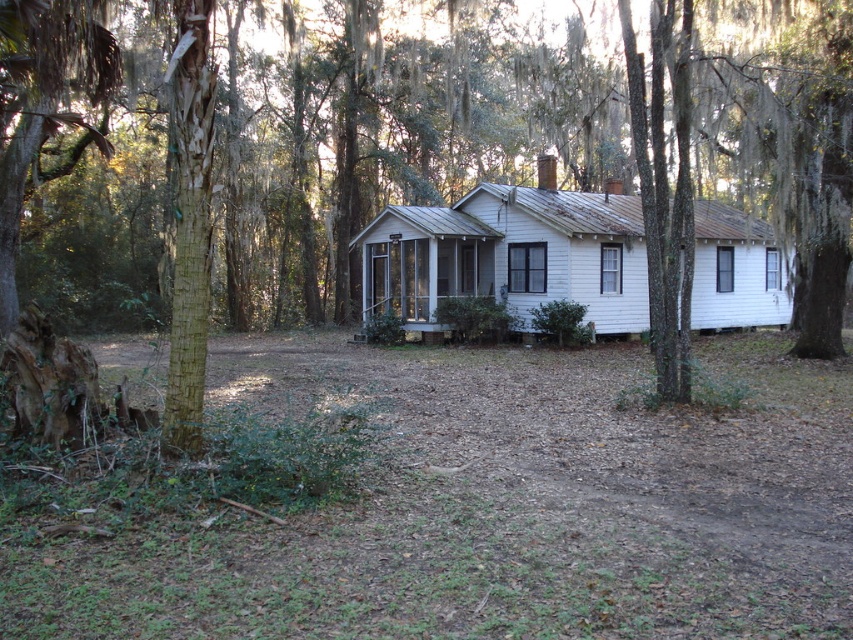
Does green mossy tree at center have a greater width compared to white wood house at center?

Indeed, green mossy tree at center has a greater width compared to white wood house at center.

In the scene shown: Is the position of green mossy tree at center more distant than that of white wood house at center?

No, it is in front of white wood house at center.

The height and width of the screenshot is (640, 853). I want to click on green mossy tree at center, so click(x=512, y=184).